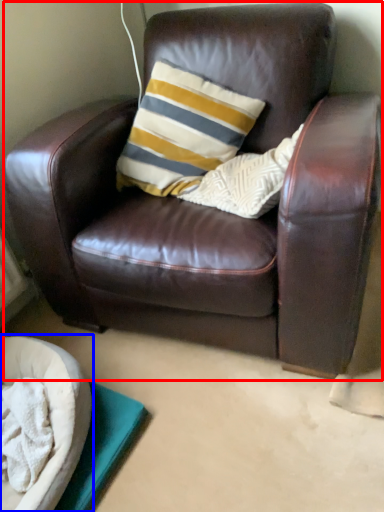
Question: Which object appears farthest to the camera in this image, chair (highlighted by a red box) or dog bed (highlighted by a blue box)?

Choices:
 (A) chair
 (B) dog bed

Answer: (B)